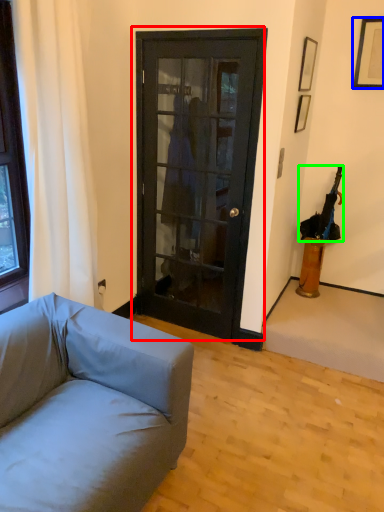
Question: Estimate the real-world distances between objects in this image. Which object is farther from door (highlighted by a red box), picture frame (highlighted by a blue box) or umbrella (highlighted by a green box)?

Choices:
 (A) picture frame
 (B) umbrella

Answer: (A)